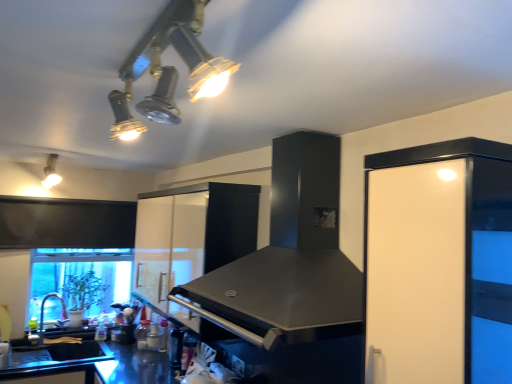
Question: In the image, is white glossy cabinet at right, which ranks as the 1th cabinetry in front-to-back order, positioned in front of or behind black matte sink at lower left?

Choices:
 (A) front
 (B) behind

Answer: (A)

Question: Visually, is white glossy cabinet at right, which is the second cabinetry in left-to-right order, positioned to the left or to the right of black matte sink at lower left?

Choices:
 (A) right
 (B) left

Answer: (A)

Question: Estimate the real-world distances between objects in this image. Which object is farther from the matte white light fixture at upper left, the second light fixture when ordered from right to left?

Choices:
 (A) white glossy cabinet at right, which ranks as the 1th cabinetry in front-to-back order
 (B) transparent glass window screen at lower left
 (C) brushed metal faucet at lower left
 (D) white glossy cabinet at center, placed as the first cabinetry when sorted from left to right
 (E) black matte sink at lower left

Answer: (A)

Question: Considering the real-world distances, which object is farthest from the white glossy cabinet at right, the second cabinetry in the back-to-front sequence?

Choices:
 (A) black matte vent at center
 (B) black matte sink at lower left
 (C) brushed metal faucet at lower left
 (D) transparent glass window screen at lower left
 (E) white glossy cabinet at center, the 1th cabinetry from the back

Answer: (C)